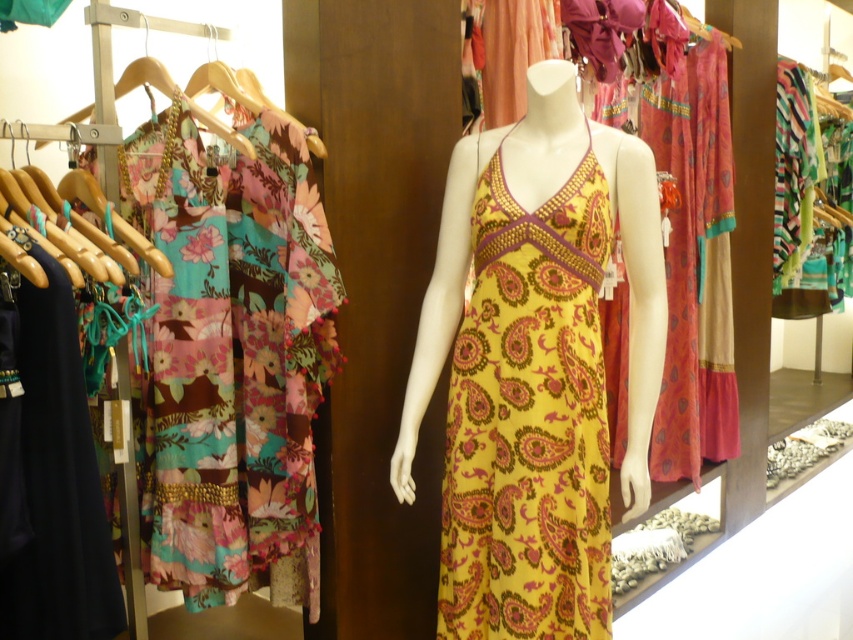
Question: Is yellow paisley fabric dress at center positioned before wooden hanger at upper left?

Choices:
 (A) yes
 (B) no

Answer: (B)

Question: Which of the following is the farthest from the observer?

Choices:
 (A) (103, 77)
 (B) (473, 211)

Answer: (B)

Question: Observing the image, what is the correct spatial positioning of yellow paisley fabric dress at center in reference to wooden hanger at upper left?

Choices:
 (A) right
 (B) left

Answer: (A)

Question: Observing the image, what is the correct spatial positioning of yellow paisley fabric dress at center in reference to wooden hanger at upper left?

Choices:
 (A) right
 (B) left

Answer: (A)